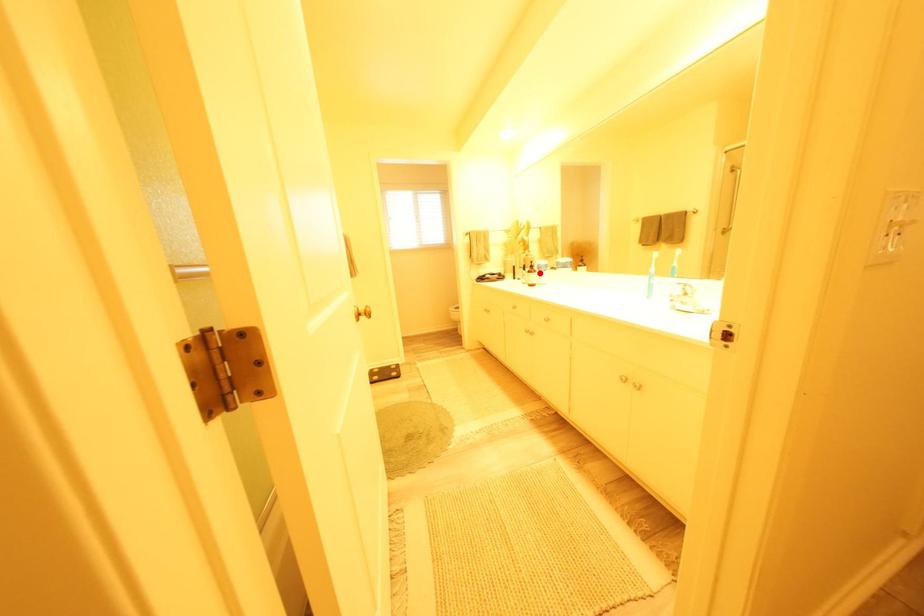
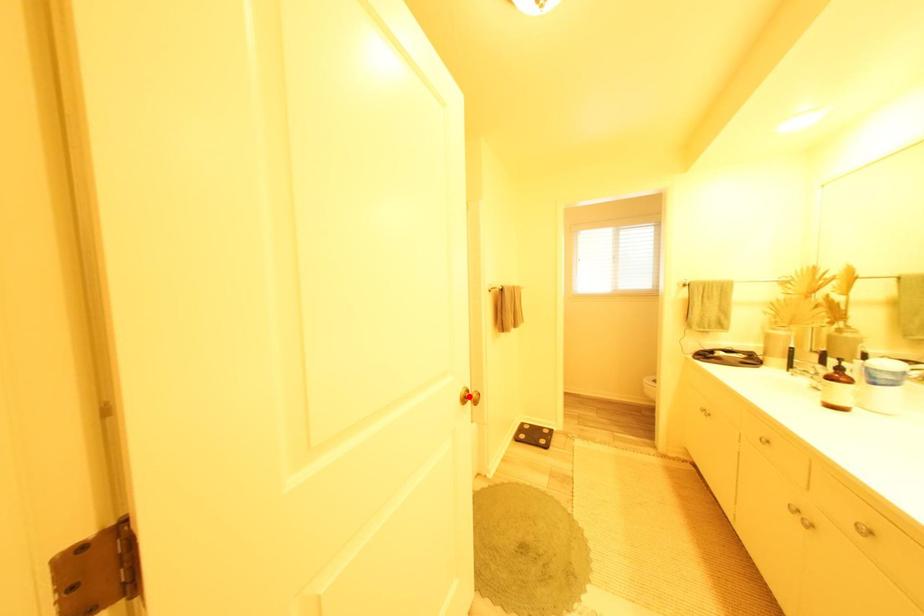
I am providing you with two images of the same scene from different viewpoints. A red point is marked on the first image and another point is marked on the second image. Do the highlighted points in image1 and image2 indicate the same real-world spot?

No